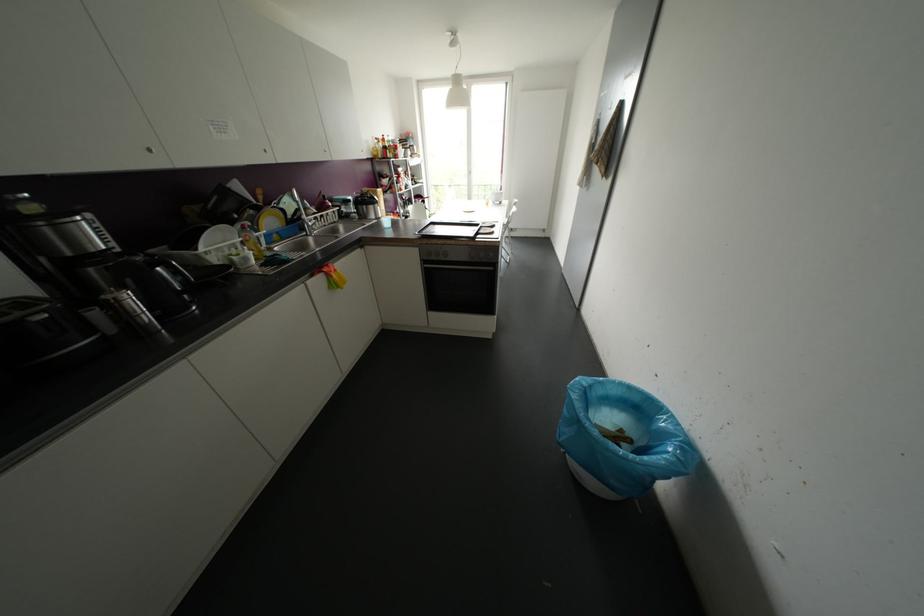
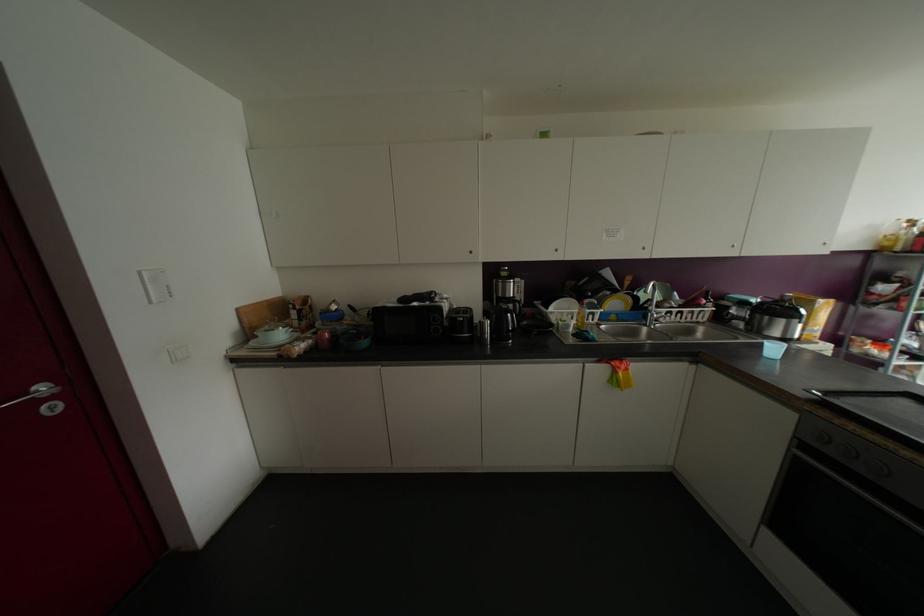
Question: I am providing you with two images of the same scene from different viewpoints. Which of the following objects are not visible in image2?

Choices:
 (A) black oven handle
 (B) yellow plate
 (C) dark blue bowl
 (D) none of these

Answer: (D)